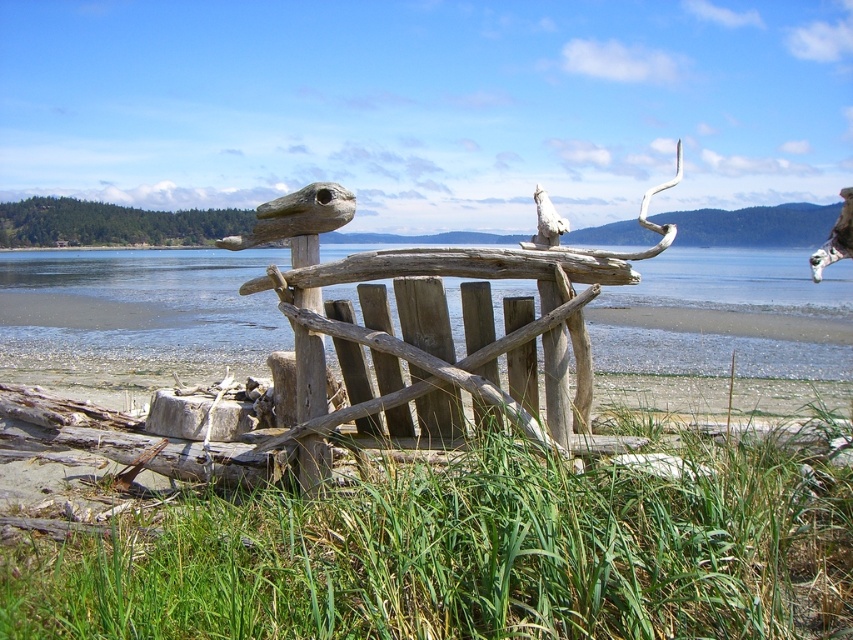
Question: Is green grass at lower center bigger than driftwood bench at center?

Choices:
 (A) no
 (B) yes

Answer: (B)

Question: Is brown wooden water at center behind driftwood bench at center?

Choices:
 (A) no
 (B) yes

Answer: (B)

Question: Which object is the closest to the green grass at lower center?

Choices:
 (A) driftwood bench at center
 (B) brown wooden water at center

Answer: (A)

Question: Is green grass at lower center closer to camera compared to driftwood bench at center?

Choices:
 (A) no
 (B) yes

Answer: (B)

Question: Among these points, which one is nearest to the camera?

Choices:
 (A) (648, 342)
 (B) (782, 630)
 (C) (386, 380)

Answer: (B)

Question: Which object is the closest to the driftwood bench at center?

Choices:
 (A) green grass at lower center
 (B) brown wooden water at center

Answer: (A)